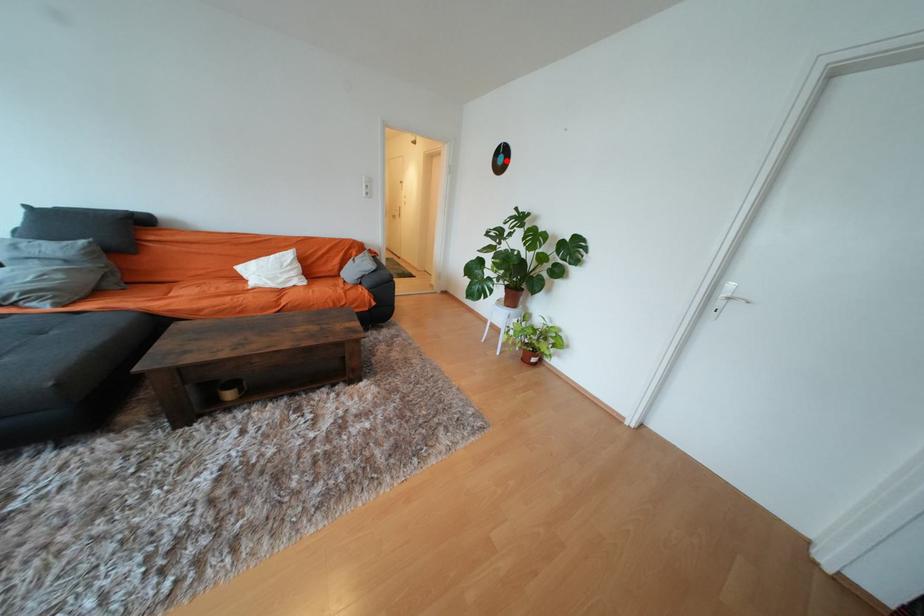
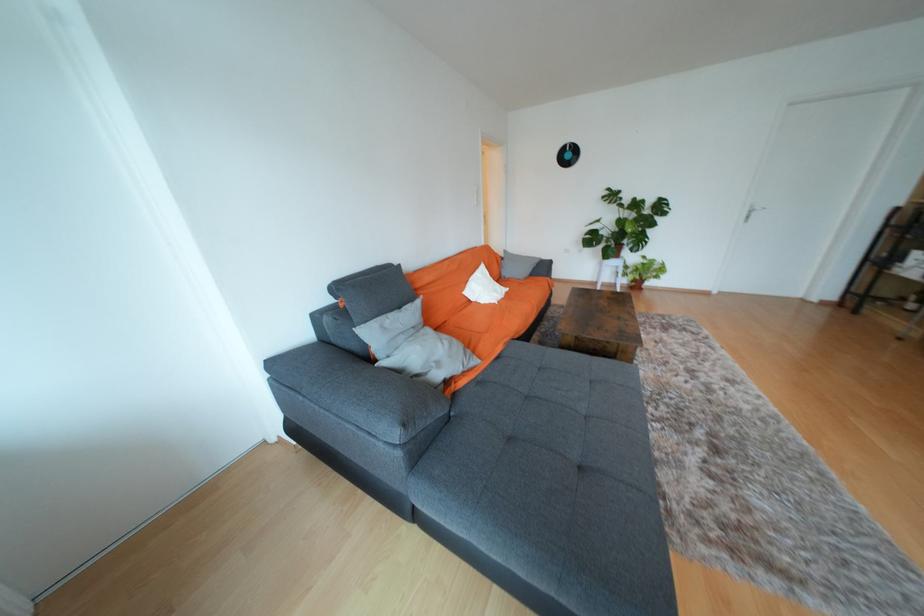
Where in the second image is the point corresponding to the highlighted location from the first image?

(574, 156)